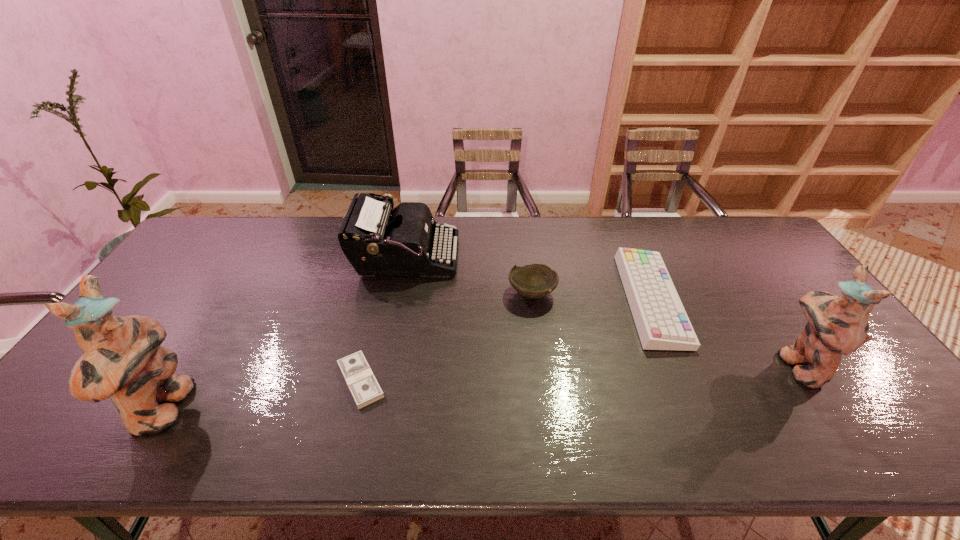
Find the location of a particular element. The height and width of the screenshot is (540, 960). object that is at the right edge is located at coordinates (836, 325).

Locate an element on the screen. The height and width of the screenshot is (540, 960). object that is at the near right corner is located at coordinates (836, 325).

Locate an element on the screen. Image resolution: width=960 pixels, height=540 pixels. vacant space at the far edge is located at coordinates (473, 231).

Identify the location of free point at the near edge. This screenshot has height=540, width=960. (808, 388).

The image size is (960, 540). I want to click on free space at the left edge, so click(205, 268).

You are a GUI agent. You are given a task and a screenshot of the screen. Output one action in this format:
    pyautogui.click(x=<x>, y=<y>)
    Task: Click on the vacant space at the right edge of the desktop
    
    Given the screenshot: What is the action you would take?
    pyautogui.click(x=780, y=321)

Find the location of a particular element. The image size is (960, 540). free spot at the far right corner of the desktop is located at coordinates (722, 218).

The width and height of the screenshot is (960, 540). In order to click on free spot between the dollar and the third tallest object in this screenshot , I will do `click(383, 319)`.

The height and width of the screenshot is (540, 960). I want to click on free space between the dollar and the fifth tallest object, so click(x=506, y=340).

This screenshot has height=540, width=960. I want to click on free space between the taller figurine and the computer keyboard, so click(x=407, y=355).